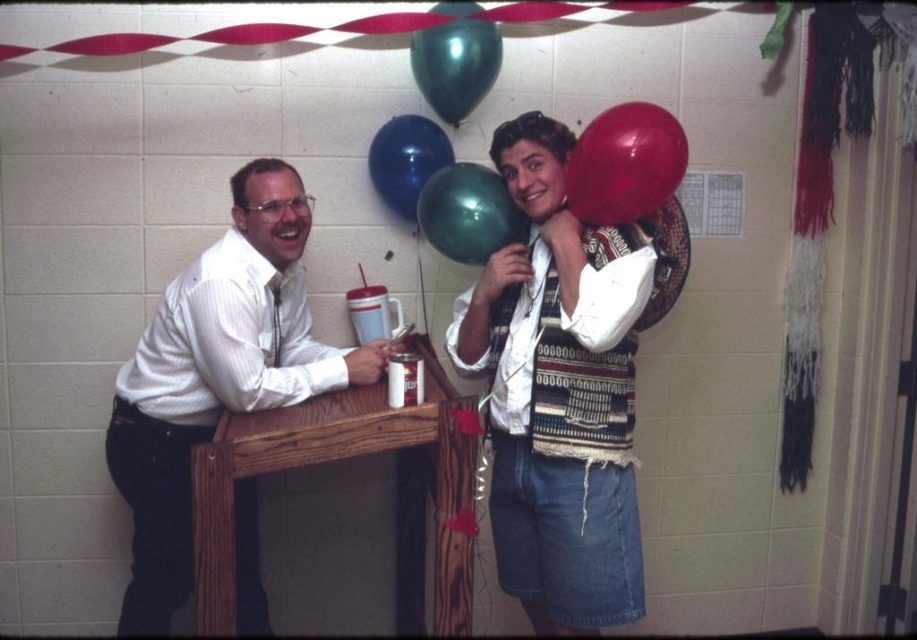
Which is below, white shirt at left or blue glossy balloon at upper center?

Positioned lower is white shirt at left.

Between white shirt at left and blue glossy balloon at upper center, which one appears on the right side from the viewer's perspective?

From the viewer's perspective, blue glossy balloon at upper center appears more on the right side.

The height and width of the screenshot is (640, 917). Describe the element at coordinates (216, 376) in the screenshot. I see `white shirt at left` at that location.

Locate an element on the screen. The width and height of the screenshot is (917, 640). white shirt at left is located at coordinates click(x=216, y=376).

Is knitted sweater at upper right to the right of white shirt at left from the viewer's perspective?

Indeed, knitted sweater at upper right is positioned on the right side of white shirt at left.

Who is taller, knitted sweater at upper right or white shirt at left?

With more height is knitted sweater at upper right.

In order to click on knitted sweater at upper right in this screenshot , I will do `click(558, 392)`.

Is point (542, 314) positioned behind point (666, 198)?

Yes, it is.

Is point (622, 426) closer to viewer compared to point (668, 125)?

No, it is behind (668, 125).

Locate an element on the screen. This screenshot has height=640, width=917. knitted sweater at upper right is located at coordinates (558, 392).